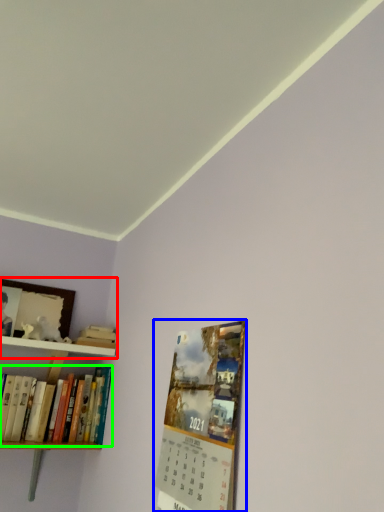
Question: Which object is positioned farthest from shelf (highlighted by a red box)? Select from magazine (highlighted by a blue box) and book (highlighted by a green box).

Choices:
 (A) magazine
 (B) book

Answer: (A)